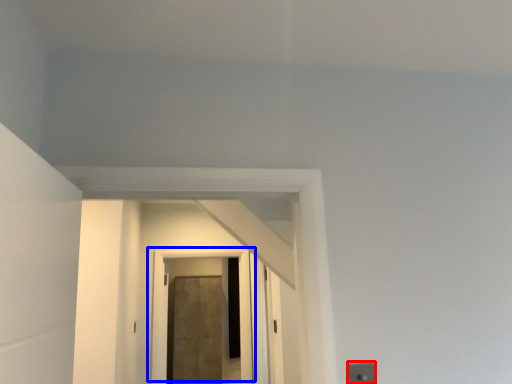
Question: Which object is further to the camera taking this photo, electric outlet (highlighted by a red box) or door (highlighted by a blue box)?

Choices:
 (A) electric outlet
 (B) door

Answer: (B)